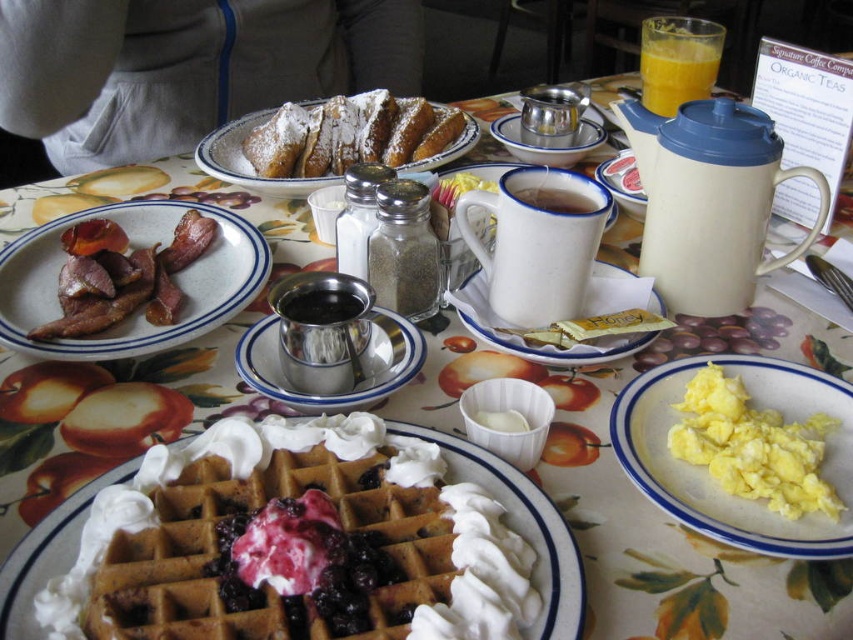
Question: Does golden brown waffle with whipped cream and berries at center appear under shiny metallic pot at center?

Choices:
 (A) yes
 (B) no

Answer: (A)

Question: Estimate the real-world distances between objects in this image. Which object is farther from the translucent plastic cup at upper right?

Choices:
 (A) yellow scrambled eggs at lower right
 (B) silver metallic syrup container at center
 (C) powdered sugar pastry at center
 (D) brown crispy bacon at left

Answer: (D)

Question: Which point is farther to the camera?

Choices:
 (A) (372, 372)
 (B) (672, 93)
 (C) (318, 301)

Answer: (B)

Question: Which object is farther from the camera taking this photo?

Choices:
 (A) translucent plastic cup at upper right
 (B) white matte mug at center

Answer: (A)

Question: Can you confirm if brown crispy bacon at left is positioned to the right of white matte mug at center?

Choices:
 (A) no
 (B) yes

Answer: (A)

Question: Can you confirm if yellow scrambled eggs at lower right is positioned to the right of powdered sugar pastry at center?

Choices:
 (A) yes
 (B) no

Answer: (A)